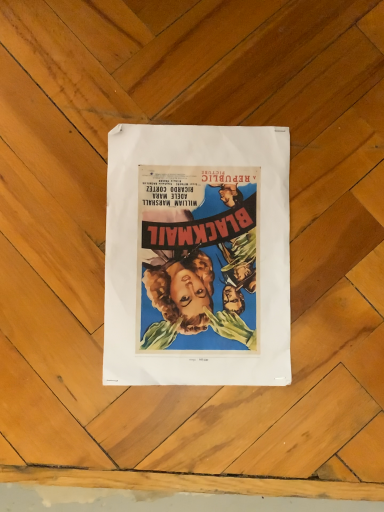
I want to click on vacant area on top of vibrant paper poster at center (from a real-world perspective), so tap(208, 238).